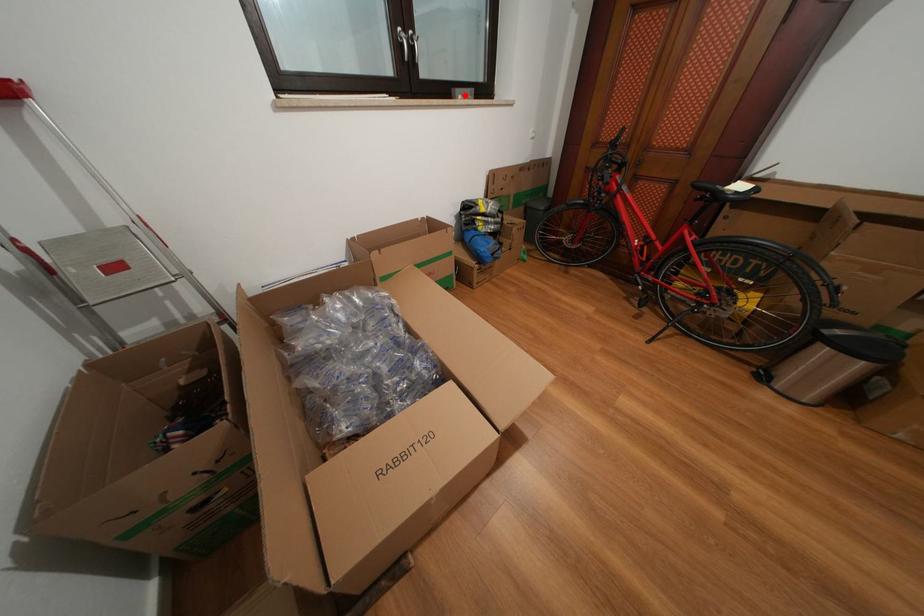
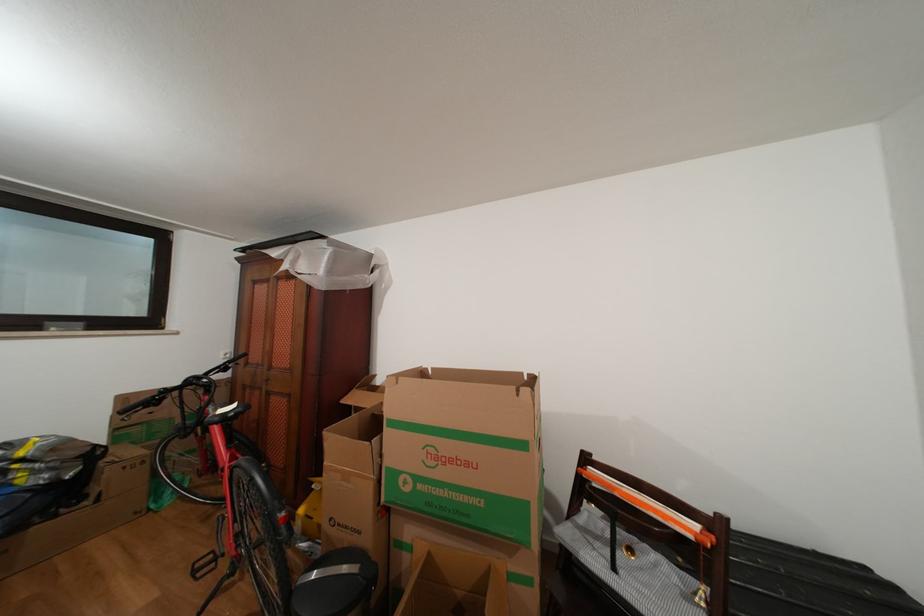
Find the pixel in the second image that matches the highlighted location in the first image.

(56, 329)